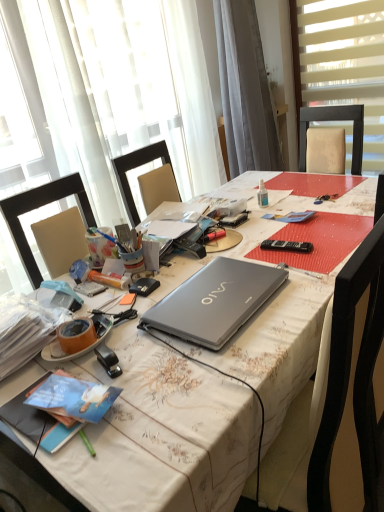
What are the coordinates of `free space between black plastic remote control at center and black plastic remote control at center` in the screenshot? It's located at (242, 249).